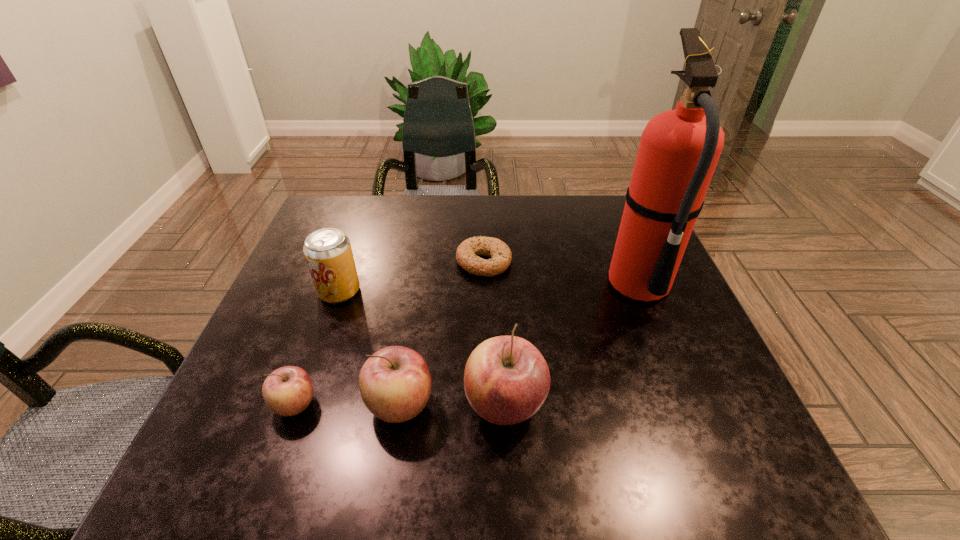
Image resolution: width=960 pixels, height=540 pixels. In order to click on free point that keeps the apples evenly spaced on the right in this screenshot , I will do `click(611, 405)`.